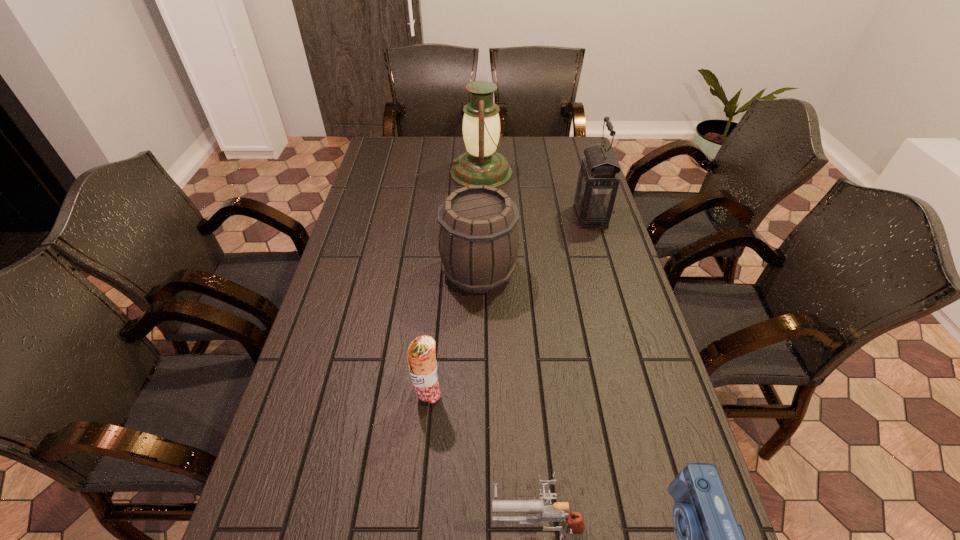
You are a GUI agent. You are given a task and a screenshot of the screen. Output one action in this format:
    pyautogui.click(x=<x>, y=<y>)
    Task: Click on the farthest object
    
    Given the screenshot: What is the action you would take?
    pyautogui.click(x=481, y=164)

The width and height of the screenshot is (960, 540). Identify the location of the farther lantern. (481, 164).

What are the coordinates of `the nearer lantern` in the screenshot? It's located at (598, 180).

In order to click on the second farthest object in this screenshot , I will do click(x=598, y=180).

Locate an element on the screen. the third farthest object is located at coordinates (478, 243).

At what (x,y) coordinates should I click in order to perform the action: click on the third tallest object. Please return your answer as a coordinate pair (x, y). The height and width of the screenshot is (540, 960). Looking at the image, I should click on (478, 243).

You are a GUI agent. You are given a task and a screenshot of the screen. Output one action in this format:
    pyautogui.click(x=<x>, y=<y>)
    Task: Click on the third shortest object
    
    Given the screenshot: What is the action you would take?
    coord(421,356)

You are a GUI agent. You are given a task and a screenshot of the screen. Output one action in this format:
    pyautogui.click(x=<x>, y=<y>)
    Task: Click on the burrito
    This screenshot has height=540, width=960.
    Given the screenshot: What is the action you would take?
    point(421,356)

Where is `blank space located with the light compartment facing forward on the left lantern`? The width and height of the screenshot is (960, 540). blank space located with the light compartment facing forward on the left lantern is located at coordinates (422, 173).

The height and width of the screenshot is (540, 960). Identify the location of vacant space located with the light compartment facing forward on the left lantern. (393, 173).